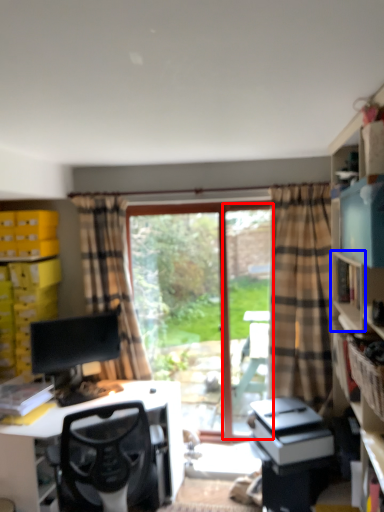
Question: Among these objects, which one is nearest to the camera, screen door (highlighted by a red box) or shelf (highlighted by a blue box)?

Choices:
 (A) screen door
 (B) shelf

Answer: (B)